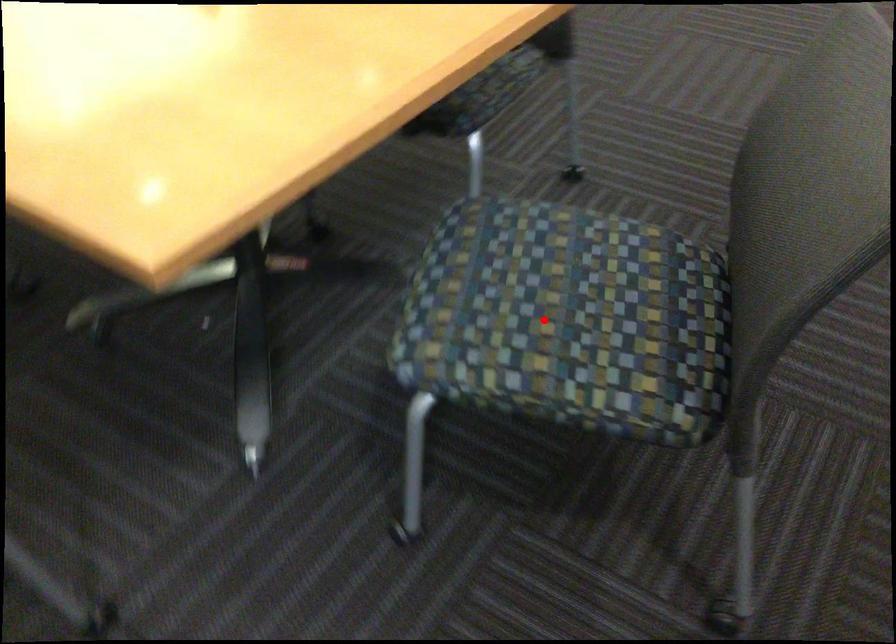
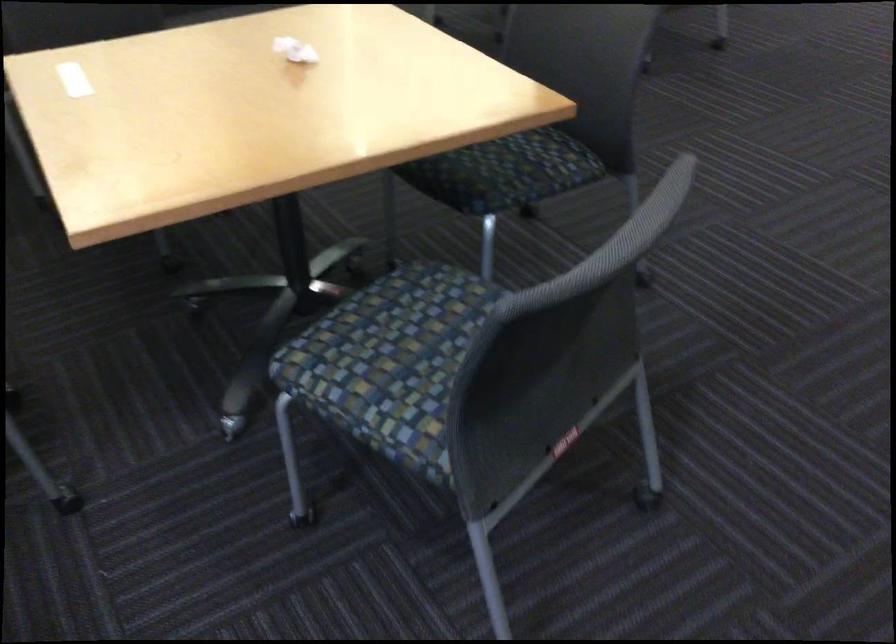
Question: I am providing you with two images of the same scene from different viewpoints. A red point is marked on the first image. At the location where the point appears in image 1, is it still visible in image 2?

Choices:
 (A) Yes
 (B) No

Answer: (A)